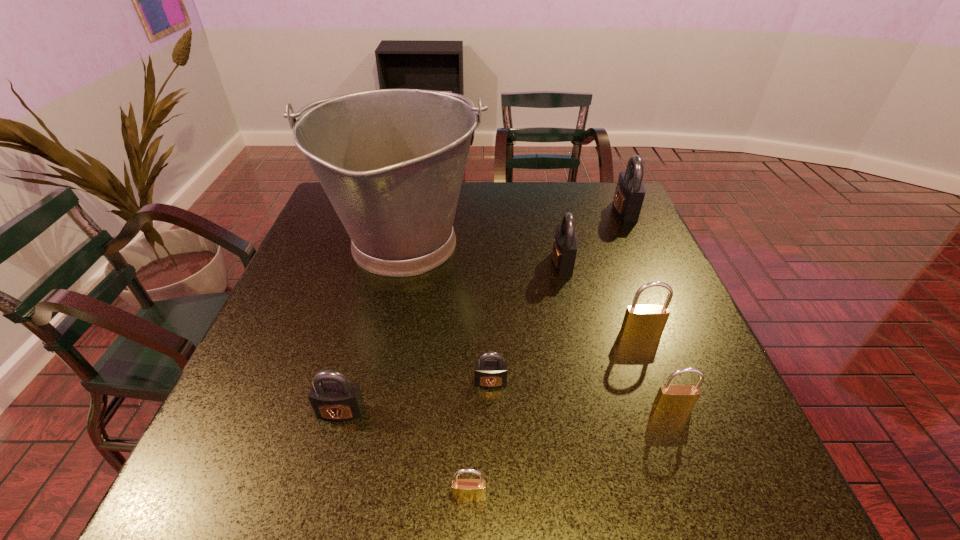
Identify which brass padlock is the nearest to the fourth nearest object. Please provide its 2D coordinates. Your answer should be formatted as a tuple, i.e. [(x, y)], where the tuple contains the x and y coordinates of a point satisfying the conditions above.

[(465, 490)]

Image resolution: width=960 pixels, height=540 pixels. Find the location of `brass padlock that is the nearest to the nearest object`. brass padlock that is the nearest to the nearest object is located at coordinates (670, 398).

Locate an element on the screen. vacant space that satisfies the following two spatial constraints: 1. on the front of the sixth nearest padlock near the keyhole; 2. on the front-facing side of the nearest brass padlock is located at coordinates (614, 496).

Locate an element on the screen. The image size is (960, 540). free space that satisfies the following two spatial constraints: 1. on the front of the rightmost padlock near the keyhole; 2. on the front side of the bucket is located at coordinates (640, 246).

The width and height of the screenshot is (960, 540). I want to click on free space that satisfies the following two spatial constraints: 1. on the front of the farthest gray padlock near the keyhole; 2. on the front-facing side of the biggest brass padlock, so click(x=680, y=333).